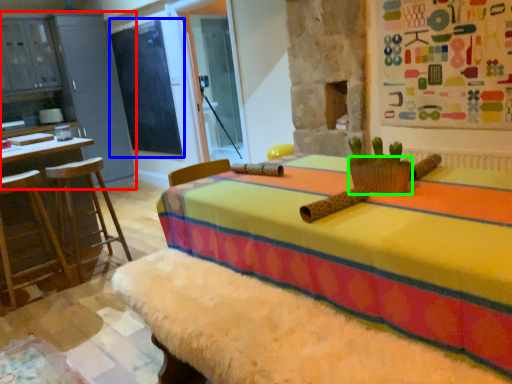
Question: Which is nearer to the dresser (highlighted by a red box)? bulletin board (highlighted by a blue box) or basket (highlighted by a green box).

Choices:
 (A) bulletin board
 (B) basket

Answer: (A)